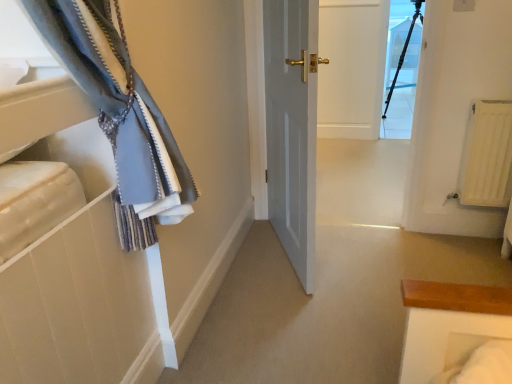
Question: Should I look upward or downward to see transparent glass tripod at upper center?

Choices:
 (A) up
 (B) down

Answer: (A)

Question: Would you say transparent glass tripod at upper center is a long distance from white matte radiator at right?

Choices:
 (A) no
 (B) yes

Answer: (B)

Question: From the image's perspective, would you say transparent glass tripod at upper center is shown under white matte radiator at right?

Choices:
 (A) yes
 (B) no

Answer: (B)

Question: Can you confirm if transparent glass tripod at upper center is wider than white matte radiator at right?

Choices:
 (A) yes
 (B) no

Answer: (B)

Question: From the image's perspective, is transparent glass tripod at upper center above white matte radiator at right?

Choices:
 (A) no
 (B) yes

Answer: (B)

Question: Is transparent glass tripod at upper center located outside white matte radiator at right?

Choices:
 (A) yes
 (B) no

Answer: (A)

Question: Considering the relative sizes of transparent glass tripod at upper center and white matte radiator at right in the image provided, is transparent glass tripod at upper center smaller than white matte radiator at right?

Choices:
 (A) yes
 (B) no

Answer: (A)

Question: Considering the relative positions of white matte radiator at right and transparent glass tripod at upper center in the image provided, is white matte radiator at right to the left of transparent glass tripod at upper center from the viewer's perspective?

Choices:
 (A) no
 (B) yes

Answer: (B)

Question: Is white matte radiator at right outside of transparent glass tripod at upper center?

Choices:
 (A) yes
 (B) no

Answer: (A)

Question: From a real-world perspective, is white matte radiator at right physically above transparent glass tripod at upper center?

Choices:
 (A) no
 (B) yes

Answer: (A)

Question: Does white matte radiator at right have a greater height compared to transparent glass tripod at upper center?

Choices:
 (A) no
 (B) yes

Answer: (A)

Question: Does white matte radiator at right have a greater width compared to transparent glass tripod at upper center?

Choices:
 (A) no
 (B) yes

Answer: (B)

Question: Is transparent glass tripod at upper center at the back of white matte radiator at right?

Choices:
 (A) no
 (B) yes

Answer: (B)

Question: Is transparent glass tripod at upper center in front of or behind white matte radiator at right in the image?

Choices:
 (A) front
 (B) behind

Answer: (B)